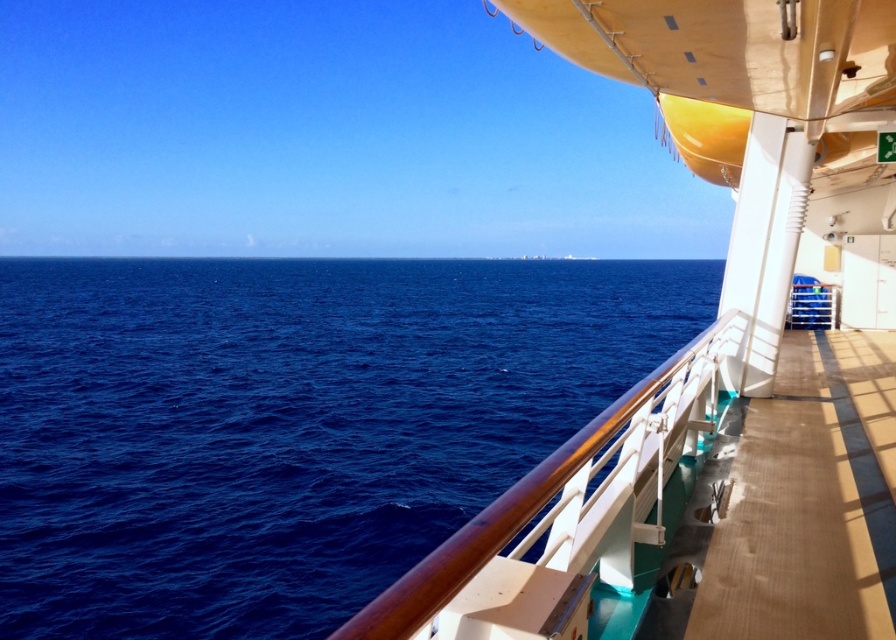
Question: Is white glossy boat at right to the left of wooden at right from the viewer's perspective?

Choices:
 (A) yes
 (B) no

Answer: (B)

Question: Which object is positioned farthest from the white glossy boat at right?

Choices:
 (A) wooden at right
 (B) deep blue water at center

Answer: (B)

Question: Is deep blue water at center smaller than white glossy boat at right?

Choices:
 (A) no
 (B) yes

Answer: (A)

Question: Which of the following is the farthest from the observer?

Choices:
 (A) wooden at right
 (B) white glossy boat at right
 (C) deep blue water at center
 (D) brown polished wood at right

Answer: (D)

Question: Which of the following is the farthest from the observer?

Choices:
 (A) (825, 621)
 (B) (257, 316)
 (C) (584, 456)
 (D) (755, 225)

Answer: (B)

Question: Does deep blue water at center have a larger size compared to brown polished wood at right?

Choices:
 (A) no
 (B) yes

Answer: (B)